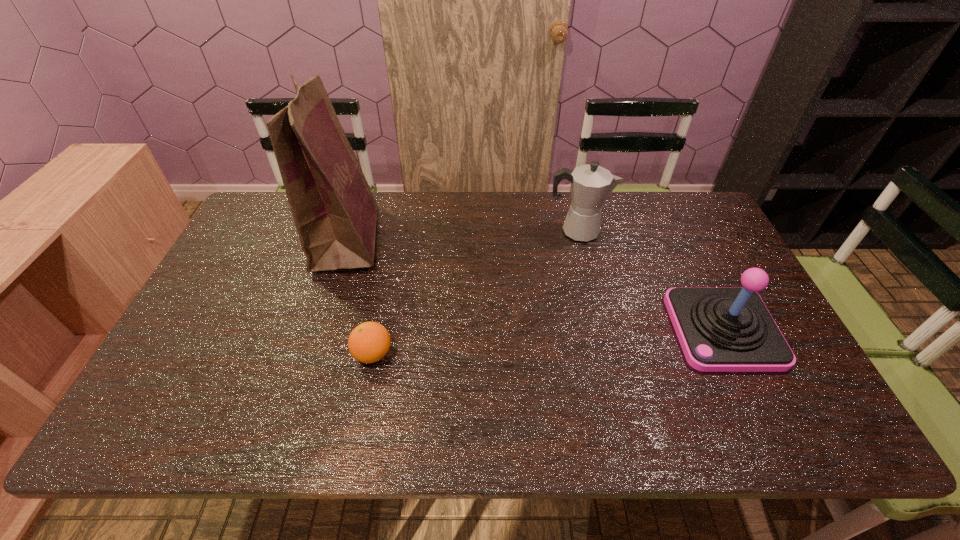
Find the location of a particular element. the tallest object is located at coordinates (335, 213).

This screenshot has height=540, width=960. I want to click on coffeepot, so click(x=591, y=184).

The height and width of the screenshot is (540, 960). What are the coordinates of `the third tallest object` in the screenshot? It's located at pyautogui.click(x=719, y=329).

Locate an element on the screen. the rightmost object is located at coordinates (719, 329).

Where is `the shortest object`? the shortest object is located at coordinates (369, 342).

You are a GUI agent. You are given a task and a screenshot of the screen. Output one action in this format:
    pyautogui.click(x=<x>, y=<y>)
    Task: Click on the free space located 0.230m on the front-facing side of the tallest object
    This screenshot has width=960, height=540.
    Given the screenshot: What is the action you would take?
    pyautogui.click(x=455, y=239)

Identify the location of vacant space located 0.090m on the front of the third object from left to right. The width and height of the screenshot is (960, 540). (585, 264).

I want to click on vacant space located 0.160m forward from the base of the rightmost object, so click(612, 329).

Find the location of a particular element. Image resolution: width=960 pixels, height=540 pixels. vacant space situated forward from the base of the rightmost object is located at coordinates (639, 329).

Find the location of a particular element. vacant position located 0.310m forward from the base of the rightmost object is located at coordinates (556, 329).